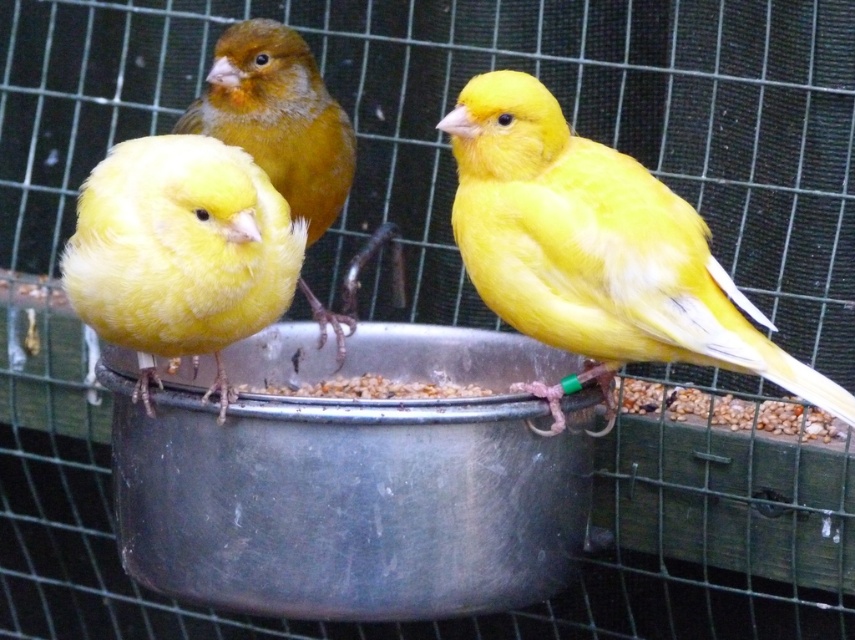
Question: Among these points, which one is farthest from the camera?

Choices:
 (A) pyautogui.click(x=653, y=301)
 (B) pyautogui.click(x=323, y=208)

Answer: (B)

Question: Which point appears farthest from the camera in this image?

Choices:
 (A) (257, 100)
 (B) (168, 269)

Answer: (A)

Question: Is yellow matte bird at center thinner than matte yellow canary at left?

Choices:
 (A) no
 (B) yes

Answer: (A)

Question: Is matte yellow canary at center to the right of yellow matte bird at center from the viewer's perspective?

Choices:
 (A) yes
 (B) no

Answer: (A)

Question: Is yellow matte bird at center positioned before matte yellow canary at left?

Choices:
 (A) yes
 (B) no

Answer: (A)

Question: Among these points, which one is farthest from the camera?

Choices:
 (A) (603, 390)
 (B) (339, 342)

Answer: (B)